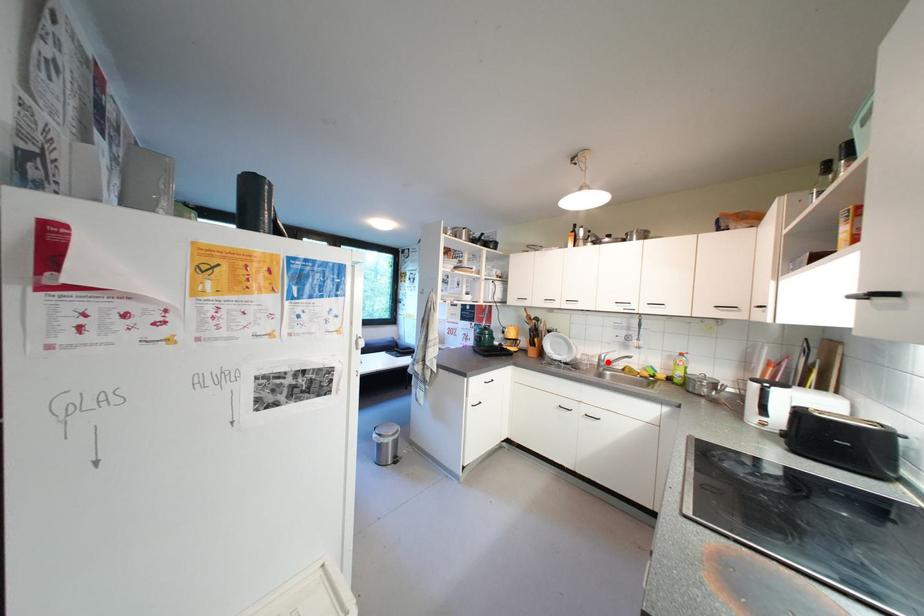
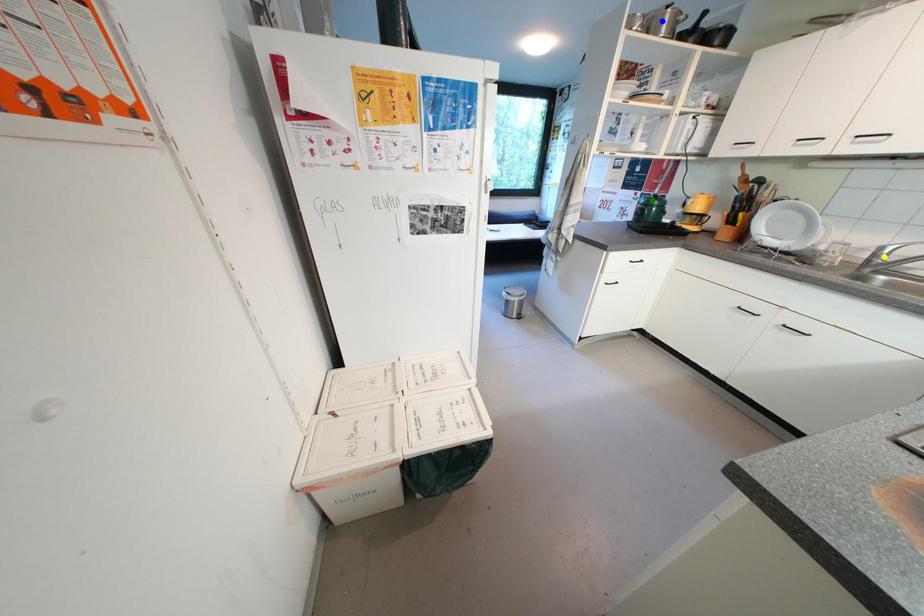
Question: I am providing you with two images of the same scene from different viewpoints. A red point is marked on the first image. You are given multiple points on the second image. Can you choose the point in image 2 that corresponds to the point in image 1?

Choices:
 (A) blue point
 (B) yellow point
 (C) green point

Answer: (B)